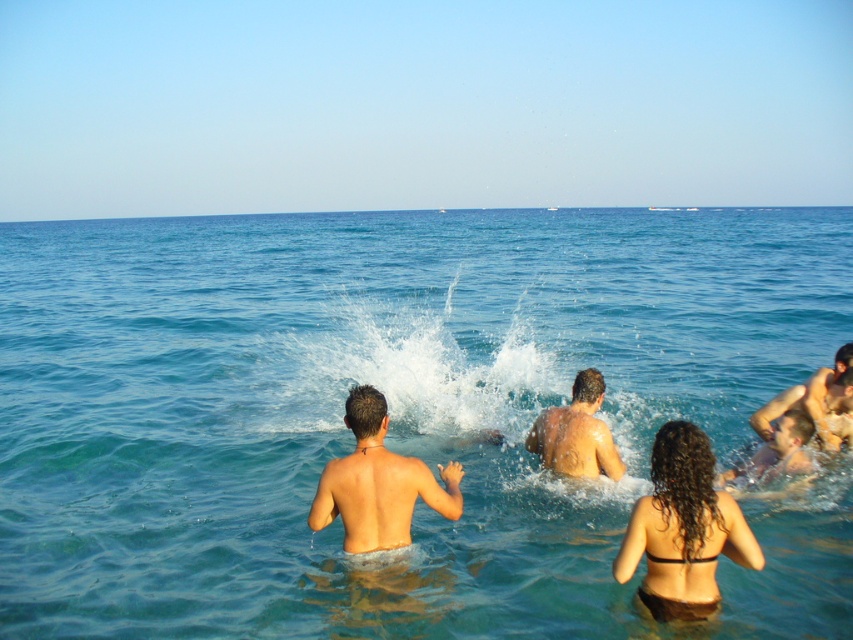
Is clear water splash at center shorter than matte skin man at center?

Incorrect, clear water splash at center's height does not fall short of matte skin man at center's.

Is point (453, 362) farther from camera compared to point (448, 512)?

Yes.

In order to click on clear water splash at center in this screenshot , I will do `click(410, 353)`.

Describe the element at coordinates (683, 529) in the screenshot. The width and height of the screenshot is (853, 640). I see `brown bikini at center` at that location.

Locate an element on the screen. brown bikini at center is located at coordinates (683, 529).

Between clear water splash at center and brown bikini at center, which one has more height?

clear water splash at center is taller.

Does point (524, 365) lie in front of point (688, 481)?

That is False.

Which is in front, point (393, 448) or point (624, 552)?

Positioned in front is point (624, 552).

This screenshot has height=640, width=853. In order to click on clear water splash at center in this screenshot , I will do `click(410, 353)`.